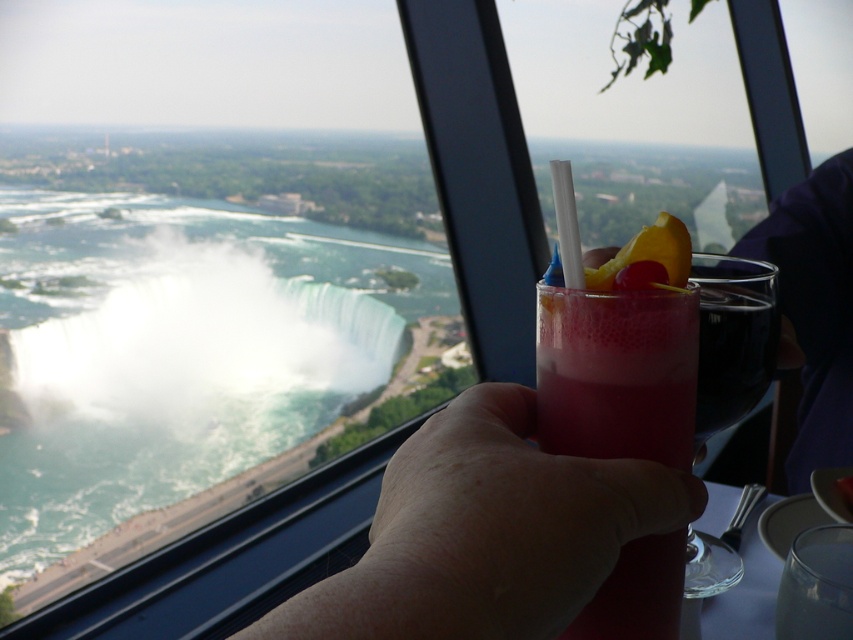
Question: Can you confirm if white misty waterfall at center is positioned below yellow rubber ring at center?

Choices:
 (A) yes
 (B) no

Answer: (A)

Question: Based on their relative distances, which object is nearer to the yellow rubber ring at center?

Choices:
 (A) pink translucent glass at center
 (B) pink frothy drink at center
 (C) white misty waterfall at center

Answer: (A)

Question: Does white misty waterfall at center have a lesser width compared to pink translucent glass at center?

Choices:
 (A) no
 (B) yes

Answer: (A)

Question: Is pink translucent glass at center bigger than yellow rubber ring at center?

Choices:
 (A) yes
 (B) no

Answer: (A)

Question: Which point appears farthest from the camera in this image?

Choices:
 (A) (460, 460)
 (B) (659, 240)
 (C) (729, 259)
 (D) (309, 266)

Answer: (D)

Question: Which of these objects is positioned farthest from the pink frothy drink at center?

Choices:
 (A) yellow rubber ring at center
 (B) white misty waterfall at center
 (C) pink translucent glass at center

Answer: (B)